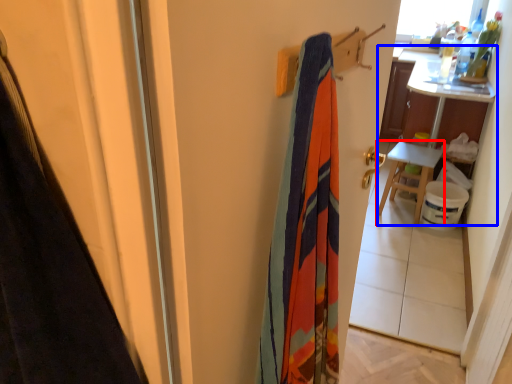
Question: Which object is closer to the camera taking this photo, furniture (highlighted by a red box) or table (highlighted by a blue box)?

Choices:
 (A) furniture
 (B) table

Answer: (B)